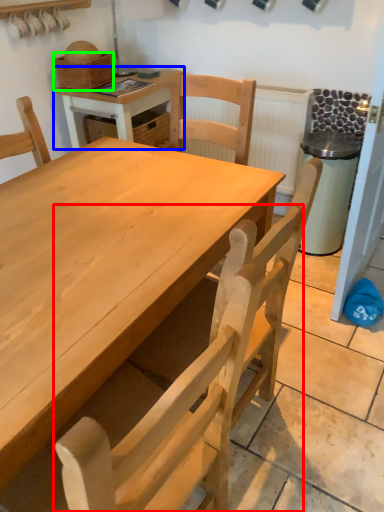
Question: Which object is the closest to the chair (highlighted by a red box)? Choose among these: table (highlighted by a blue box) or basket (highlighted by a green box).

Choices:
 (A) table
 (B) basket

Answer: (A)